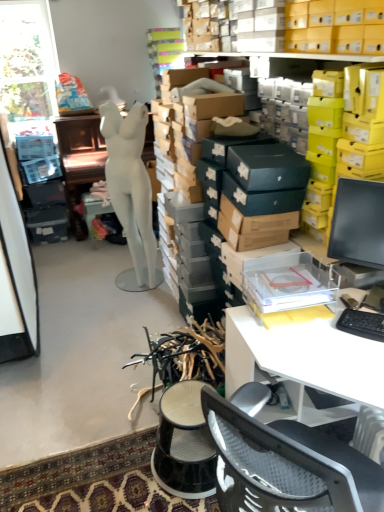
I want to click on vacant area situated to the left side of white matte mannequin at center, so click(100, 297).